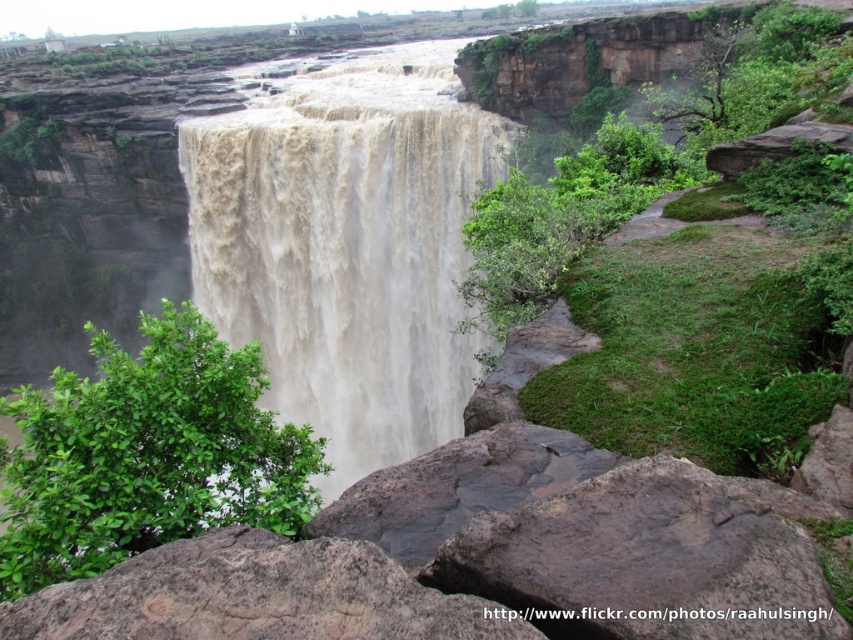
Question: Which object is the farthest from the brown rough rock at lower center?

Choices:
 (A) green leafy bush at lower left
 (B) white frothy water at center

Answer: (B)

Question: Which point is farther to the camera?

Choices:
 (A) rusty rock at center
 (B) brown rough rock at lower center
 (C) white frothy water at center

Answer: (C)

Question: Is green leafy bush at lower left below brown rough rock at lower center?

Choices:
 (A) no
 (B) yes

Answer: (B)

Question: Does white frothy water at center appear on the right side of green leafy bush at lower left?

Choices:
 (A) yes
 (B) no

Answer: (A)

Question: Among these objects, which one is nearest to the camera?

Choices:
 (A) rusty rock at center
 (B) brown rough rock at lower center

Answer: (B)

Question: Is green leafy bush at lower left positioned before brown rough rock at lower center?

Choices:
 (A) no
 (B) yes

Answer: (A)